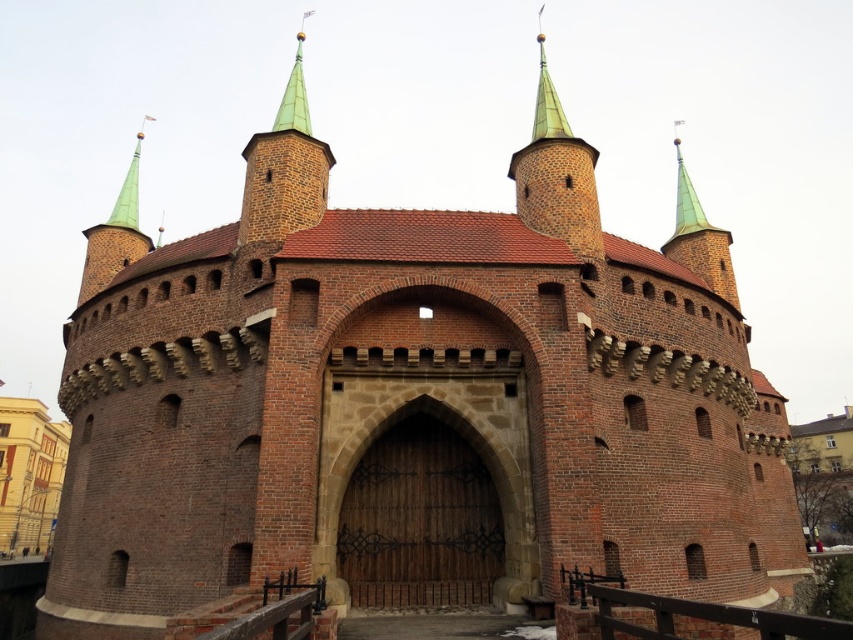
From the picture: You are standing in front of the historic stone structure and want to locate two specific points marked on the image. The first point is at coordinates point (297, 604) and the second is at point (310, 132). Which of these points is closer to the viewer?

Point (297, 604) is in front of point (310, 132), so it is closer to the viewer.